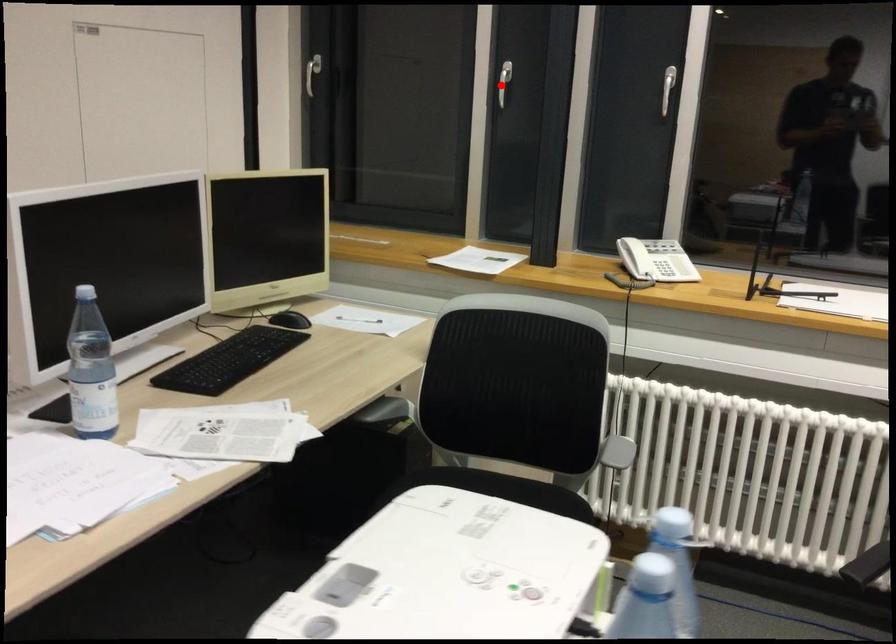
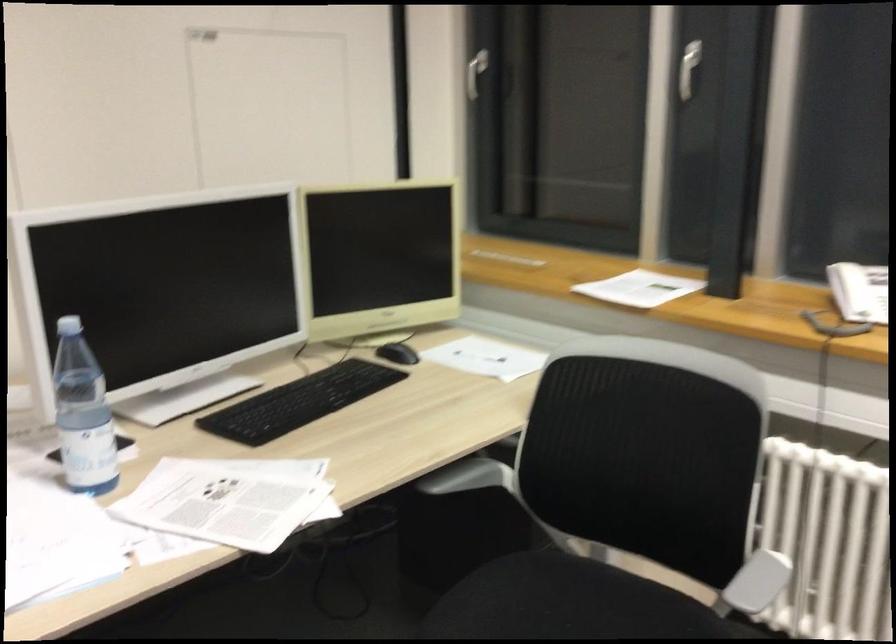
Where in the second image is the point corresponding to the highlighted location from the first image?

(688, 69)